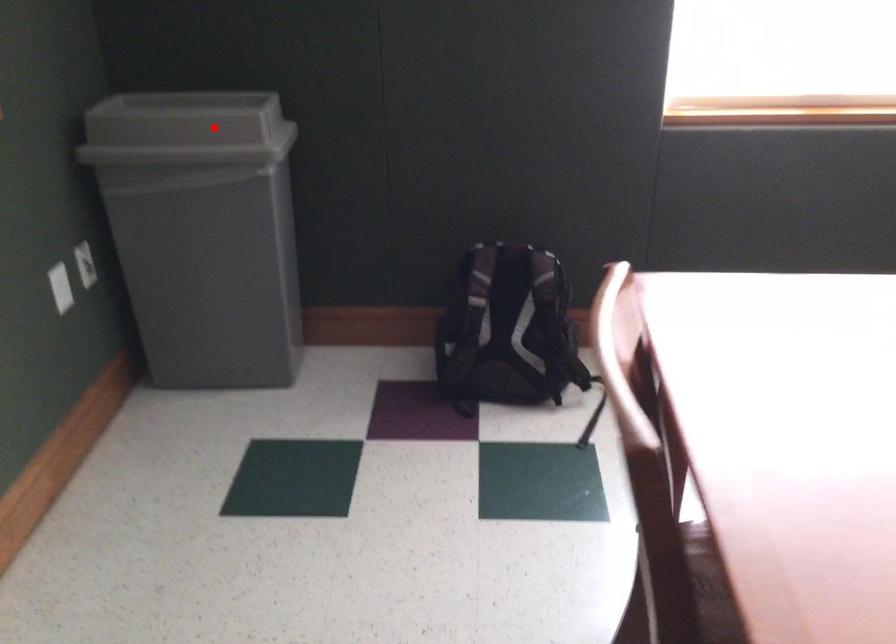
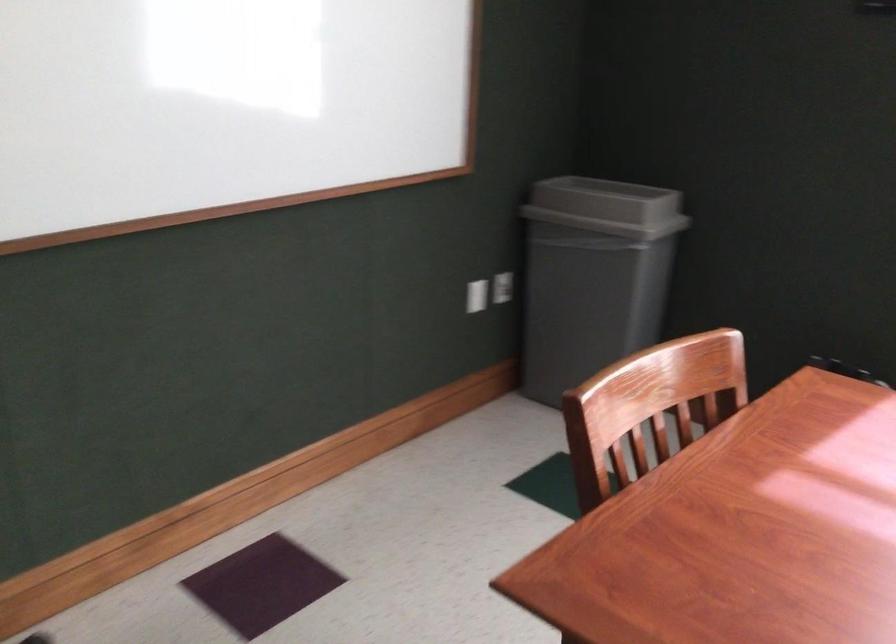
Where in the second image is the point corresponding to the highlighted location from the first image?

(607, 207)